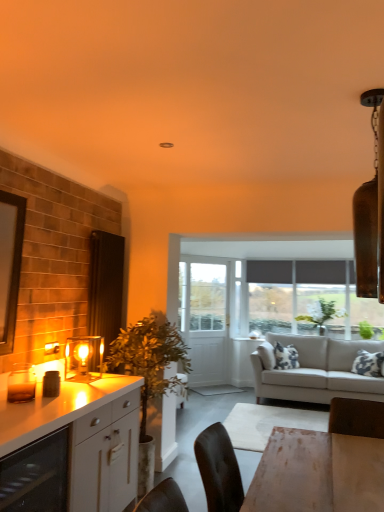
Question: Should I look upward or downward to see green leafy plant at left?

Choices:
 (A) up
 (B) down

Answer: (B)

Question: Should I look upward or downward to see light gray fabric couch at center?

Choices:
 (A) down
 (B) up

Answer: (A)

Question: Is green leafy plant at upper center shorter than white glossy cabinet at left?

Choices:
 (A) yes
 (B) no

Answer: (A)

Question: From the image's perspective, is green leafy plant at upper center beneath white glossy cabinet at left?

Choices:
 (A) yes
 (B) no

Answer: (B)

Question: Is green leafy plant at upper center positioned with its back to white glossy cabinet at left?

Choices:
 (A) yes
 (B) no

Answer: (B)

Question: Does green leafy plant at upper center appear on the left side of white glossy cabinet at left?

Choices:
 (A) no
 (B) yes

Answer: (A)

Question: Is green leafy plant at upper center touching white glossy cabinet at left?

Choices:
 (A) no
 (B) yes

Answer: (A)

Question: Is green leafy plant at upper center not near white glossy cabinet at left?

Choices:
 (A) yes
 (B) no

Answer: (A)

Question: Can you confirm if matte glass wine cooler at lower left is smaller than white glossy cabinet at left?

Choices:
 (A) no
 (B) yes

Answer: (B)

Question: Is matte glass wine cooler at lower left wider than white glossy cabinet at left?

Choices:
 (A) no
 (B) yes

Answer: (A)

Question: From a real-world perspective, is matte glass wine cooler at lower left located beneath white glossy cabinet at left?

Choices:
 (A) no
 (B) yes

Answer: (A)

Question: Is matte glass wine cooler at lower left positioned far away from white glossy cabinet at left?

Choices:
 (A) yes
 (B) no

Answer: (B)

Question: From the image's perspective, is matte glass wine cooler at lower left on top of white glossy cabinet at left?

Choices:
 (A) yes
 (B) no

Answer: (A)

Question: Is white glossy cabinet at left surrounded by matte glass wine cooler at lower left?

Choices:
 (A) no
 (B) yes

Answer: (A)

Question: Can you confirm if light gray fabric couch at center is positioned to the left of white glossy cabinet at left?

Choices:
 (A) no
 (B) yes

Answer: (A)